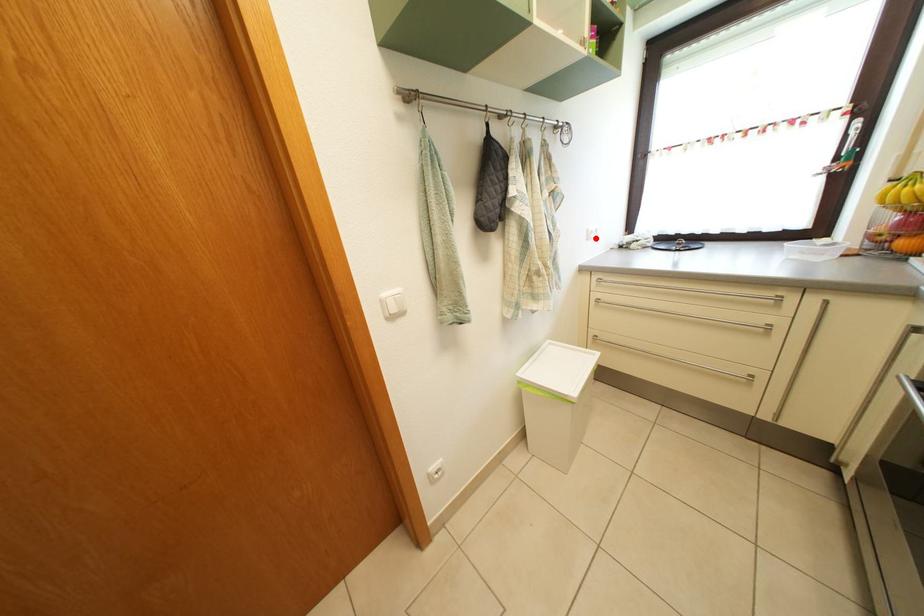
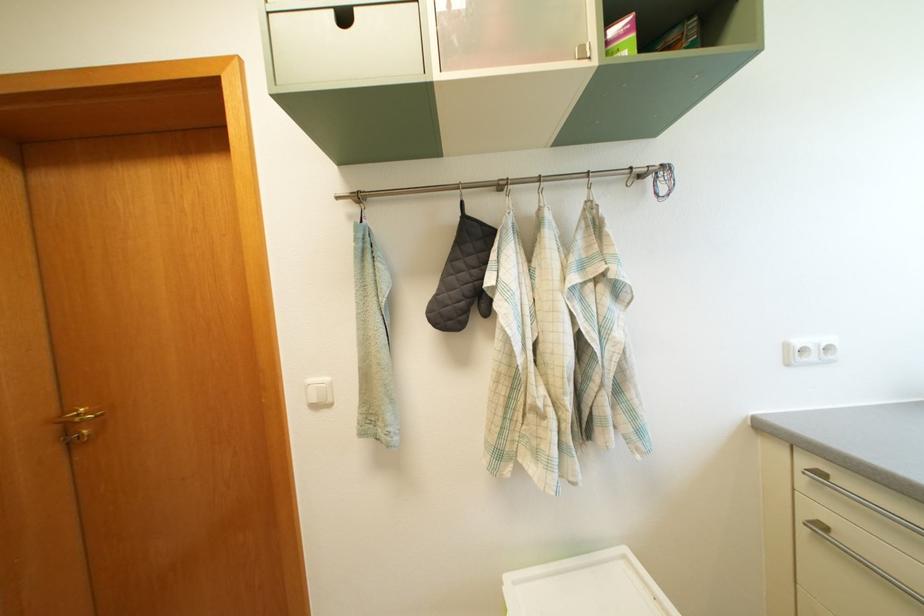
The point at the highlighted location is marked in the first image. Where is the corresponding point in the second image?

(795, 353)